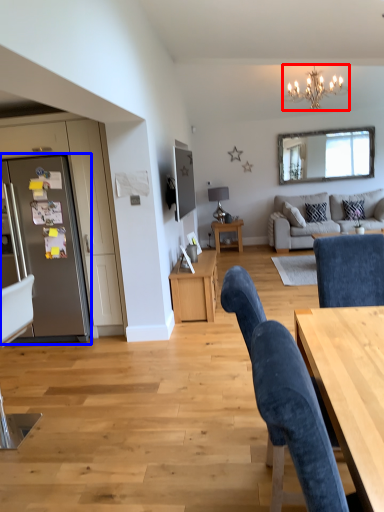
Question: Which point is further to the camera, lamp (highlighted by a red box) or fridge (highlighted by a blue box)?

Choices:
 (A) lamp
 (B) fridge

Answer: (A)